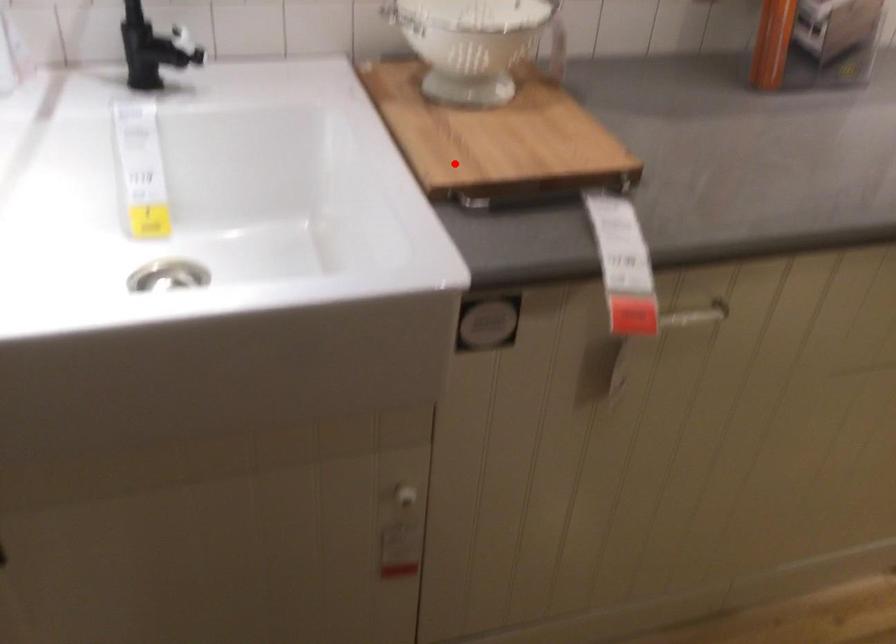
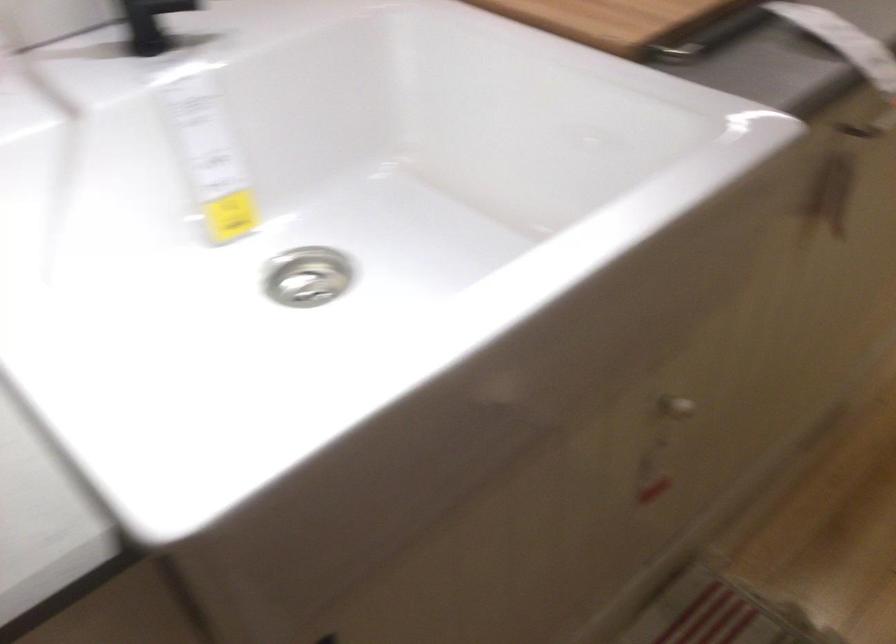
Question: I am providing you with two images of the same scene from different viewpoints. In image1, a red point is highlighted. Considering the same 3D point in image2, which of the following is correct?

Choices:
 (A) It is closer
 (B) It is farther

Answer: (A)